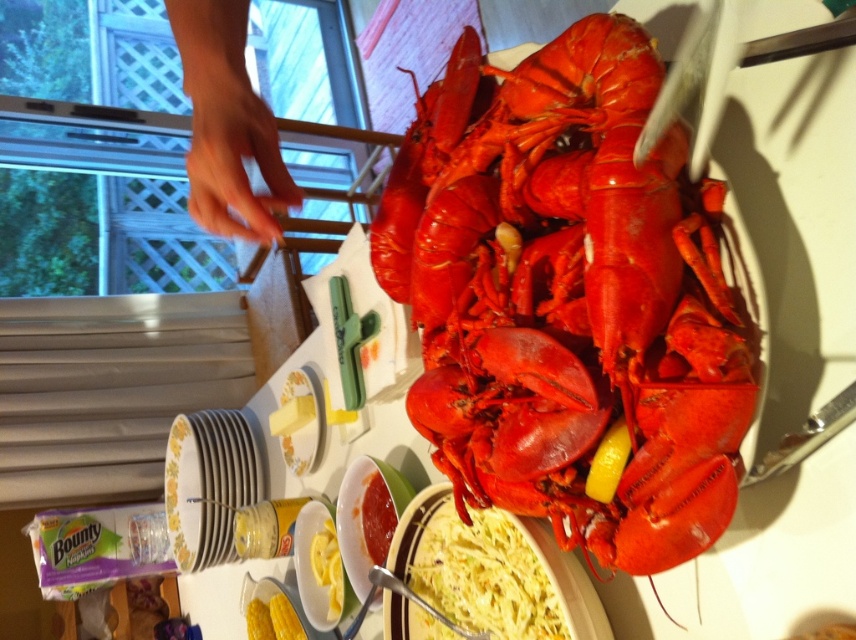
You are at a dinner table and want to pass the shiny red lobster at center to the guest on your left. Which direction should you move it relative to the smooth creamy pasta at center?

The shiny red lobster at center is to the right of the smooth creamy pasta at center, so to pass it to your left, you should move it towards the left side of the pasta.

You are a chef preparing a dish and need to place the shiny red lobster at center and the smooth creamy pasta at center on a round plate with a diameter of 12 inches. Can both items fit on the plate without overlapping?

The shiny red lobster at center is 11.63 inches from the smooth creamy pasta at center. Since the plate has a diameter of 12 inches, the maximum distance between any two points on the plate is 12 inches. The distance between the two items is less than the plate diameter, so they can fit without overlapping.